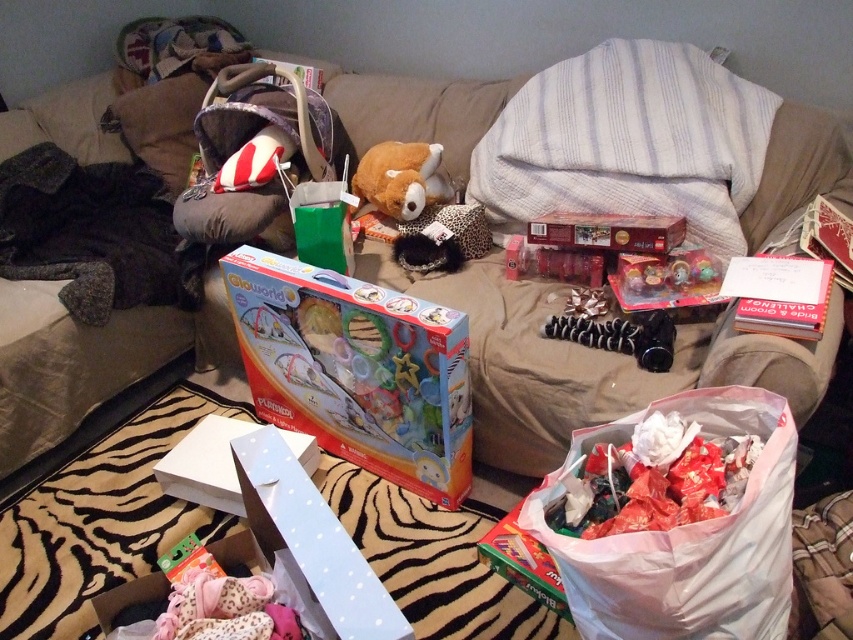
Question: Based on their relative distances, which object is farther from the white paper at upper right?

Choices:
 (A) beige fabric couch at center
 (B) brown plush at center

Answer: (B)

Question: Is multicolored cardboard box at center smaller than white paper at upper right?

Choices:
 (A) no
 (B) yes

Answer: (A)

Question: Which of the following is the farthest from the observer?

Choices:
 (A) (776, 323)
 (B) (303, 406)

Answer: (B)

Question: Which point is farther to the camera?

Choices:
 (A) matte red plastic lego box at center
 (B) white plastic bag at lower right

Answer: (A)

Question: Does velvety brown pillow at upper left have a smaller size compared to brown plush at center?

Choices:
 (A) yes
 (B) no

Answer: (B)

Question: Where is multicolored cardboard box at center located in relation to matte red plastic lego box at center in the image?

Choices:
 (A) below
 (B) above

Answer: (A)